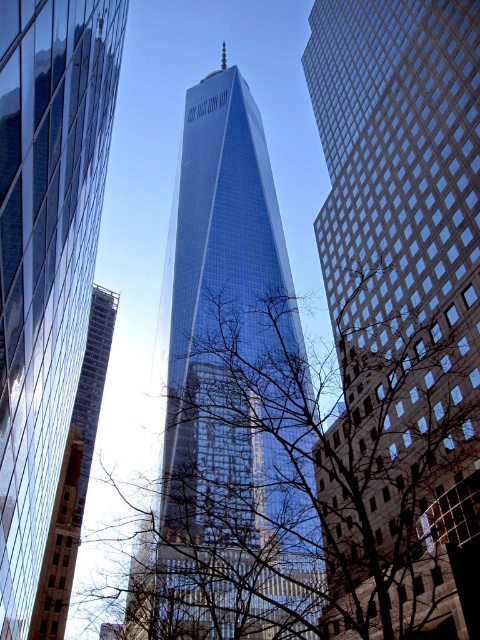
Question: Among these objects, which one is farthest from the camera?

Choices:
 (A) glassy blue skyscraper at center
 (B) brown brick building at left

Answer: (B)

Question: Which object is positioned closest to the bare branches at center?

Choices:
 (A) glassy steel skyscraper at center
 (B) glassy blue skyscraper at center
 (C) brown brick building at left
 (D) shiny glass skyscraper at center

Answer: (D)

Question: Can you confirm if bare branches at center is wider than glassy blue skyscraper at center?

Choices:
 (A) no
 (B) yes

Answer: (B)

Question: Is bare branches at center further to camera compared to brown brick building at left?

Choices:
 (A) yes
 (B) no

Answer: (B)

Question: Is glassy steel skyscraper at center behind shiny glass skyscraper at center?

Choices:
 (A) no
 (B) yes

Answer: (B)

Question: Which object is closer to the camera taking this photo?

Choices:
 (A) glassy blue skyscraper at center
 (B) shiny glass skyscraper at center
 (C) bare branches at center
 (D) brown brick building at left

Answer: (A)